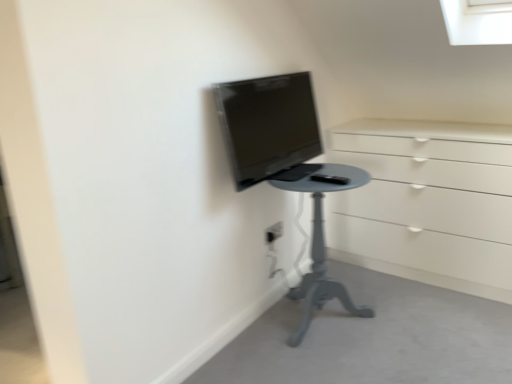
The width and height of the screenshot is (512, 384). I want to click on free space in front of matte gray table at center, so click(x=331, y=362).